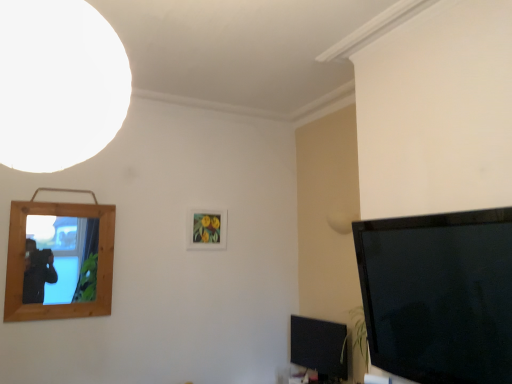
Question: Does white matte light at upper left have a larger size compared to wooden mirror at left, acting as the first picture frame starting from the front?

Choices:
 (A) yes
 (B) no

Answer: (A)

Question: Considering the relative sizes of white matte light at upper left and wooden mirror at left, acting as the first picture frame starting from the front, in the image provided, is white matte light at upper left smaller than wooden mirror at left, acting as the first picture frame starting from the front,?

Choices:
 (A) yes
 (B) no

Answer: (B)

Question: From a real-world perspective, does white matte light at upper left stand above wooden mirror at left, the first picture frame in the left-to-right sequence?

Choices:
 (A) no
 (B) yes

Answer: (B)

Question: Considering the relative positions of white matte light at upper left and wooden mirror at left, the first picture frame in the left-to-right sequence, in the image provided, is white matte light at upper left to the left of wooden mirror at left, the first picture frame in the left-to-right sequence, from the viewer's perspective?

Choices:
 (A) yes
 (B) no

Answer: (B)

Question: Is white matte light at upper left taller than wooden mirror at left, placed as the 2th picture frame when sorted from right to left?

Choices:
 (A) no
 (B) yes

Answer: (A)

Question: From a real-world perspective, is wooden mirror at left, which is the second picture frame in back-to-front order, above or below white matte light at upper left?

Choices:
 (A) above
 (B) below

Answer: (B)

Question: Considering the positions of wooden mirror at left, acting as the first picture frame starting from the front, and white matte light at upper left in the image, is wooden mirror at left, acting as the first picture frame starting from the front, wider or thinner than white matte light at upper left?

Choices:
 (A) thin
 (B) wide

Answer: (A)

Question: From the image's perspective, is wooden mirror at left, the first picture frame in the left-to-right sequence, positioned above or below white matte light at upper left?

Choices:
 (A) below
 (B) above

Answer: (A)

Question: Considering their positions, is wooden mirror at left, acting as the first picture frame starting from the front, located in front of or behind white matte light at upper left?

Choices:
 (A) front
 (B) behind

Answer: (B)

Question: In the image, is white matte light at upper left on the left side or the right side of matte wooden picture frame at center, positioned as the first picture frame in back-to-front order?

Choices:
 (A) right
 (B) left

Answer: (B)

Question: From a real-world perspective, relative to matte wooden picture frame at center, which is the first picture frame in right-to-left order, is white matte light at upper left vertically above or below?

Choices:
 (A) below
 (B) above

Answer: (B)

Question: Considering their positions, is white matte light at upper left located in front of or behind matte wooden picture frame at center, the second picture frame viewed from the front?

Choices:
 (A) front
 (B) behind

Answer: (A)

Question: From the image's perspective, is white matte light at upper left above or below matte wooden picture frame at center, the second picture frame viewed from the front?

Choices:
 (A) below
 (B) above

Answer: (B)

Question: From the image's perspective, is white matte light at upper left above or below black glossy tv at lower right?

Choices:
 (A) below
 (B) above

Answer: (B)

Question: Based on their sizes in the image, would you say white matte light at upper left is bigger or smaller than black glossy tv at lower right?

Choices:
 (A) small
 (B) big

Answer: (B)